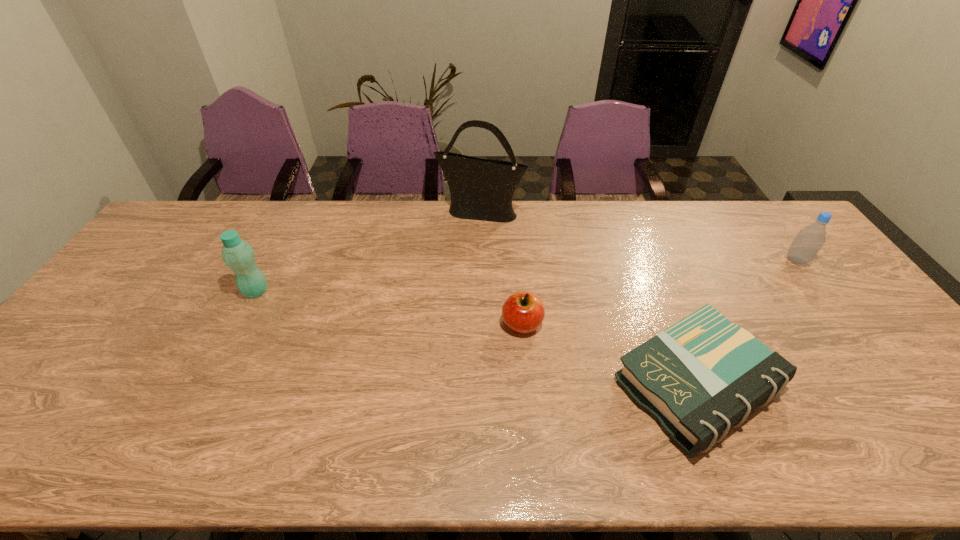
Identify the location of free space at the far left corner of the desktop. This screenshot has height=540, width=960. (170, 223).

Identify the location of free space between the third nearest object and the apple. This screenshot has height=540, width=960. click(389, 308).

You are a GUI agent. You are given a task and a screenshot of the screen. Output one action in this format:
    pyautogui.click(x=<x>, y=<y>)
    Task: Click on the vacant point located between the paperback book and the farther bottle
    This screenshot has height=540, width=960.
    Given the screenshot: What is the action you would take?
    pyautogui.click(x=747, y=323)

The image size is (960, 540). Find the location of `empty location between the paperback book and the apple`. empty location between the paperback book and the apple is located at coordinates (610, 355).

Where is `free space between the paperback book and the apple`? Image resolution: width=960 pixels, height=540 pixels. free space between the paperback book and the apple is located at coordinates (610, 355).

This screenshot has height=540, width=960. I want to click on vacant point located between the paperback book and the tallest object, so click(588, 299).

Find the location of a particular element. empty space between the farthest object and the leftmost object is located at coordinates (368, 252).

Where is `free space that is in between the tallest object and the apple`? free space that is in between the tallest object and the apple is located at coordinates click(501, 268).

Locate an element on the screen. vacant space that's between the farthest object and the apple is located at coordinates (501, 268).

Identify the location of free space between the right bottle and the apple. (660, 293).